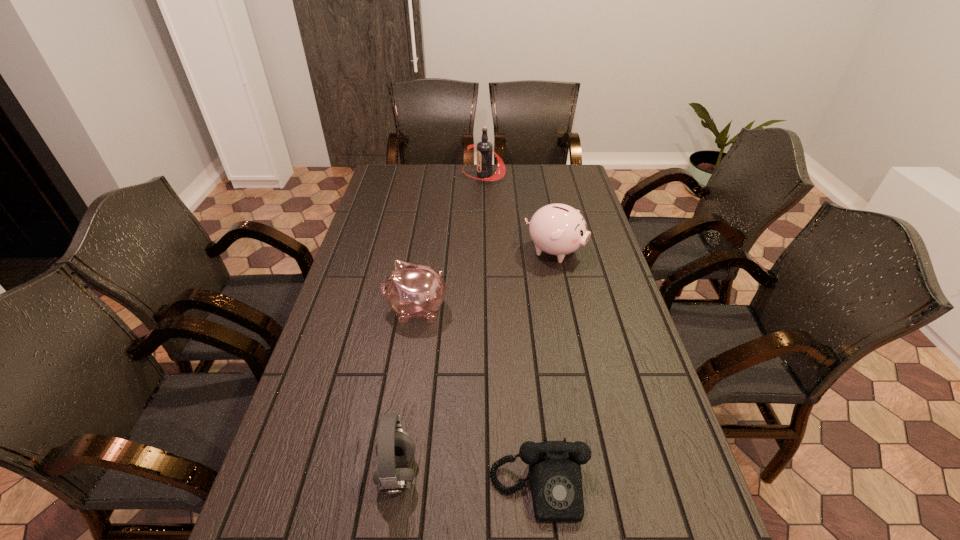
Find the location of a particular element. the tallest object is located at coordinates (485, 152).

Find the location of a particular element. the farthest object is located at coordinates pyautogui.click(x=485, y=152).

Locate an element on the screen. This screenshot has width=960, height=540. the farther piggy bank is located at coordinates (557, 229).

Find the location of a particular element. The width and height of the screenshot is (960, 540). the right piggy bank is located at coordinates (557, 229).

What are the coordinates of `headset` in the screenshot? It's located at click(x=395, y=449).

Locate an element on the screen. This screenshot has height=540, width=960. the third farthest object is located at coordinates (413, 290).

You are a GUI agent. You are given a task and a screenshot of the screen. Output one action in this format:
    pyautogui.click(x=<x>, y=<y>)
    Task: Click on the left piggy bank
    The width and height of the screenshot is (960, 540).
    Given the screenshot: What is the action you would take?
    pyautogui.click(x=413, y=290)

I want to click on the shortest object, so click(x=555, y=477).

At what (x,y) coordinates should I click in order to perform the action: click on blank space located on the label of the tallest object. Please return your answer as a coordinate pair (x, y). The image size is (960, 540). Looking at the image, I should click on (426, 174).

Find the location of a particular element. vacant space located on the label of the tallest object is located at coordinates (438, 174).